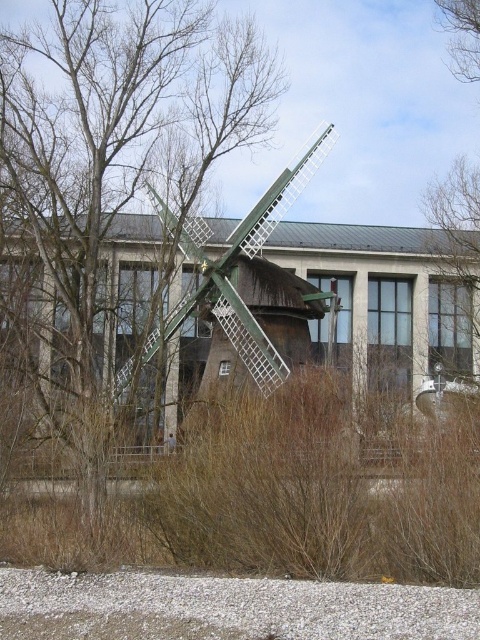
Looking at this image, does brown leafless tree at center appear under green matte windmill at center?

Correct, brown leafless tree at center is located below green matte windmill at center.

Can you confirm if brown leafless tree at center is shorter than green matte windmill at center?

No.

Is point (233, 74) behind point (275, 349)?

No.

At what (x,y) coordinates should I click in order to perform the action: click on brown leafless tree at center. Please return your answer as a coordinate pair (x, y). Looking at the image, I should click on (115, 161).